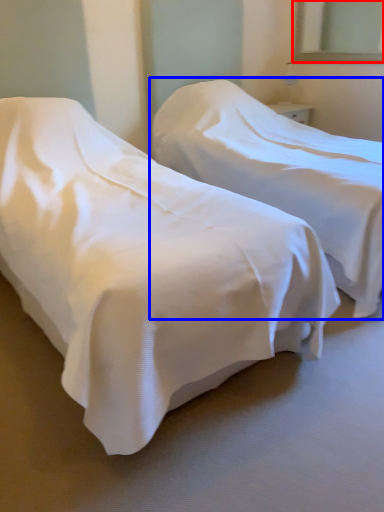
Question: Which object appears closest to the camera in this image, mirror (highlighted by a red box) or bed (highlighted by a blue box)?

Choices:
 (A) mirror
 (B) bed

Answer: (B)